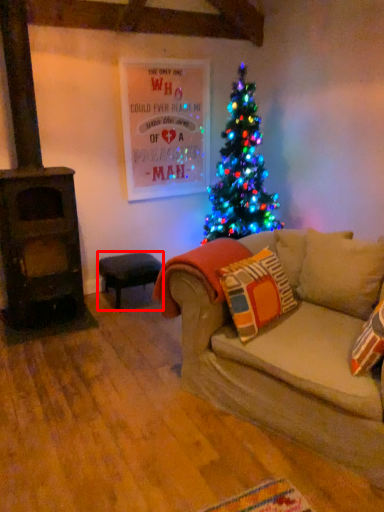
Question: From the image's perspective, what is the correct spatial positioning of stool (annotated by the red box) in reference to blanket?

Choices:
 (A) above
 (B) below

Answer: (B)